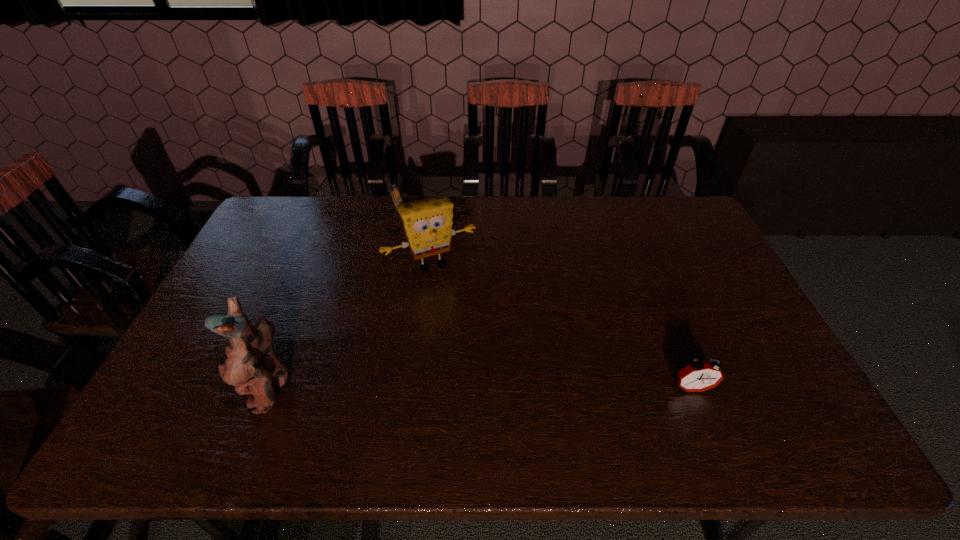
This screenshot has height=540, width=960. I want to click on vacant point located on the face of the sponge, so click(x=468, y=317).

What are the coordinates of `vacant space situated 0.380m on the face of the sponge` in the screenshot? It's located at (499, 375).

Locate an element on the screen. This screenshot has width=960, height=540. blank area located 0.240m on the face of the sponge is located at coordinates (478, 335).

Image resolution: width=960 pixels, height=540 pixels. I want to click on free space located at the stem of the farthest object, so click(412, 254).

Identify the location of vacant space located at the stem of the farthest object. (414, 258).

The image size is (960, 540). I want to click on vacant region located at the stem of the farthest object, so click(x=407, y=241).

I want to click on object present at the far edge, so click(396, 196).

Find the location of a particular element. figurine present at the near edge is located at coordinates (249, 363).

Find the location of a particular element. The height and width of the screenshot is (540, 960). alarm clock that is positioned at the near edge is located at coordinates (699, 376).

The width and height of the screenshot is (960, 540). I want to click on vacant space at the far edge of the desktop, so click(x=555, y=224).